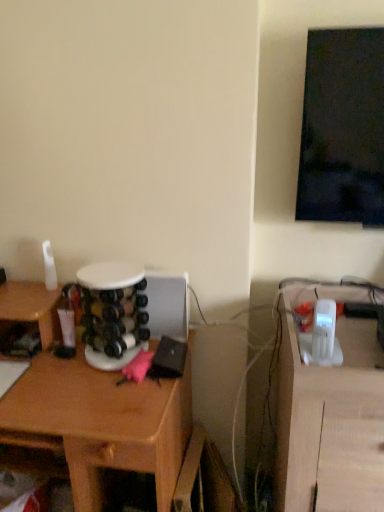
Describe the element at coordinates (331, 424) in the screenshot. I see `white plastic phone at right` at that location.

Where is `white plastic phone at right`? This screenshot has width=384, height=512. white plastic phone at right is located at coordinates (331, 424).

Measure the distance between point (340, 462) and camera.

Point (340, 462) and camera are 1.01 meters apart from each other.

Identify the location of wooden desk at left. [101, 423].

What do you see at coordinates (101, 423) in the screenshot? I see `wooden desk at left` at bounding box center [101, 423].

Where is `white plastic phone at right`? This screenshot has height=512, width=384. white plastic phone at right is located at coordinates (331, 424).

Considering the relative positions of wooden desk at left and white plastic phone at right in the image provided, is wooden desk at left to the left of white plastic phone at right from the viewer's perspective?

Yes.

Is the position of wooden desk at left more distant than that of white plastic phone at right?

Yes, it is.

Considering the positions of points (177, 428) and (331, 506), is point (177, 428) farther from camera compared to point (331, 506)?

Yes, point (177, 428) is farther from viewer.

From the image's perspective, which one is positioned higher, wooden desk at left or white plastic phone at right?

wooden desk at left appears higher in the image.

From a real-world perspective, who is located higher, wooden desk at left or white plastic phone at right?

white plastic phone at right.

Which of these two, wooden desk at left or white plastic phone at right, is thinner?

wooden desk at left is thinner.

Between wooden desk at left and white plastic phone at right, which one has less height?

Standing shorter between the two is wooden desk at left.

Does wooden desk at left have a smaller size compared to white plastic phone at right?

Actually, wooden desk at left might be larger than white plastic phone at right.

Is wooden desk at left situated inside white plastic phone at right or outside?

wooden desk at left is spatially situated outside white plastic phone at right.

Is wooden desk at left in contact with white plastic phone at right?

No, wooden desk at left is not with white plastic phone at right.

Is wooden desk at left turned away from white plastic phone at right?

No.

How different are the orientations of wooden desk at left and white plastic phone at right in degrees?

The angular difference between wooden desk at left and white plastic phone at right is 1.69 degrees.

How far apart are wooden desk at left and white plastic phone at right?

A distance of 45.51 centimeters exists between wooden desk at left and white plastic phone at right.

Where is `computer desk in front of the wooden desk at left`? computer desk in front of the wooden desk at left is located at coordinates (331, 424).

Based on the photo, which object is positioned more to the right, white plastic phone at right or wooden desk at left?

Positioned to the right is white plastic phone at right.

In the image, is white plastic phone at right positioned in front of or behind wooden desk at left?

white plastic phone at right is positioned closer to the viewer than wooden desk at left.

Is point (359, 321) positioned behind point (157, 463)?

Yes, point (359, 321) is behind point (157, 463).

From the picture: From the image's perspective, is white plastic phone at right above or below wooden desk at left?

Clearly, from the image's perspective, white plastic phone at right is below wooden desk at left.

From a real-world perspective, is white plastic phone at right located higher than wooden desk at left?

Correct, in the physical world, white plastic phone at right is higher than wooden desk at left.

Is white plastic phone at right wider than wooden desk at left?

Yes, white plastic phone at right is wider than wooden desk at left.

Is white plastic phone at right shorter than wooden desk at left?

No.

Is white plastic phone at right bigger than wooden desk at left?

Incorrect, white plastic phone at right is not larger than wooden desk at left.

Is white plastic phone at right completely or partially outside of wooden desk at left?

Yes.

Is white plastic phone at right next to wooden desk at left and touching it?

No, white plastic phone at right is not beside wooden desk at left.

Does white plastic phone at right turn towards wooden desk at left?

No, white plastic phone at right is not facing towards wooden desk at left.

What's the angular difference between white plastic phone at right and wooden desk at left's facing directions?

white plastic phone at right and wooden desk at left are facing 1.69 degrees away from each other.

This screenshot has width=384, height=512. In order to click on desk located underneath the white plastic phone at right (from a real-world perspective) in this screenshot , I will do `click(101, 423)`.

I want to click on desk above the white plastic phone at right (from the image's perspective), so click(101, 423).

This screenshot has height=512, width=384. Find the location of `desk that is behind the white plastic phone at right`. desk that is behind the white plastic phone at right is located at coordinates (101, 423).